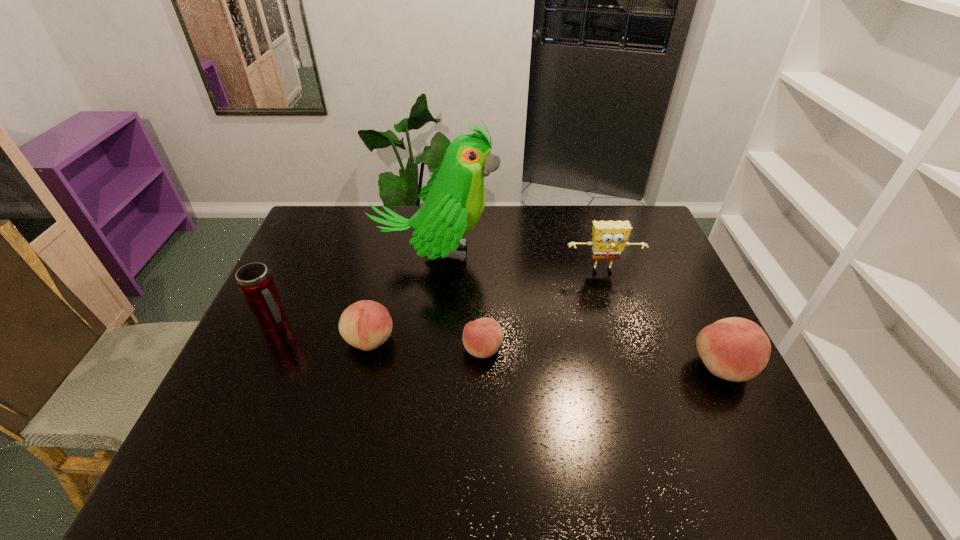
Locate an element on the screen. This screenshot has width=960, height=540. vacant area at the left edge is located at coordinates (257, 355).

Locate an element on the screen. The width and height of the screenshot is (960, 540). vacant region at the right edge of the desktop is located at coordinates (689, 393).

Identify the location of free point at the far left corner. Image resolution: width=960 pixels, height=540 pixels. (332, 206).

The image size is (960, 540). In order to click on vacant space at the near right corner in this screenshot , I will do `click(724, 421)`.

Identify the location of free space between the tallest object and the second peach from right to left. This screenshot has width=960, height=540. (460, 301).

Locate an element on the screen. Image resolution: width=960 pixels, height=540 pixels. blank region between the leftmost peach and the parakeet is located at coordinates (402, 298).

Where is `free space that is in between the shortest object and the rightmost peach`? This screenshot has height=540, width=960. free space that is in between the shortest object and the rightmost peach is located at coordinates (603, 358).

Where is `unoccupied area between the parakeet and the second object from right to left`? unoccupied area between the parakeet and the second object from right to left is located at coordinates (519, 263).

The height and width of the screenshot is (540, 960). I want to click on free spot between the second shortest peach and the tallest object, so click(402, 298).

Where is `free space between the second peach from left to right and the second tallest peach`? free space between the second peach from left to right and the second tallest peach is located at coordinates (426, 345).